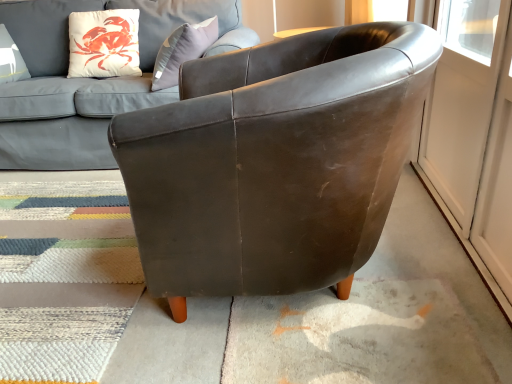
Question: Is the depth of leather chair at center less than that of textured wool mat at lower left?

Choices:
 (A) yes
 (B) no

Answer: (A)

Question: Is textured wool mat at lower left surrounded by leather chair at center?

Choices:
 (A) yes
 (B) no

Answer: (B)

Question: Is textured wool mat at lower left at the back of leather chair at center?

Choices:
 (A) no
 (B) yes

Answer: (A)

Question: Is leather chair at center not inside textured wool mat at lower left?

Choices:
 (A) no
 (B) yes

Answer: (B)

Question: From a real-world perspective, is leather chair at center physically below textured wool mat at lower left?

Choices:
 (A) yes
 (B) no

Answer: (B)

Question: In the image, is matte leather couch at upper center on the left side or the right side of white glossy screen door at right?

Choices:
 (A) right
 (B) left

Answer: (B)

Question: From their relative heights in the image, would you say matte leather couch at upper center is taller or shorter than white glossy screen door at right?

Choices:
 (A) short
 (B) tall

Answer: (B)

Question: Is matte leather couch at upper center inside the boundaries of white glossy screen door at right, or outside?

Choices:
 (A) outside
 (B) inside

Answer: (A)

Question: From the image's perspective, is matte leather couch at upper center above or below white glossy screen door at right?

Choices:
 (A) above
 (B) below

Answer: (A)

Question: Looking at their shapes, would you say matte leather couch at upper center is wider or thinner than textured wool mat at lower left?

Choices:
 (A) wide
 (B) thin

Answer: (B)

Question: From a real-world perspective, is matte leather couch at upper center positioned above or below textured wool mat at lower left?

Choices:
 (A) below
 (B) above

Answer: (B)

Question: From the image's perspective, is matte leather couch at upper center located above or below textured wool mat at lower left?

Choices:
 (A) above
 (B) below

Answer: (A)

Question: Considering their positions, is matte leather couch at upper center located in front of or behind textured wool mat at lower left?

Choices:
 (A) behind
 (B) front

Answer: (A)

Question: Is textured wool mat at lower left wider or thinner than matte leather couch at upper center?

Choices:
 (A) wide
 (B) thin

Answer: (A)

Question: Based on their sizes in the image, would you say textured wool mat at lower left is bigger or smaller than matte leather couch at upper center?

Choices:
 (A) small
 (B) big

Answer: (A)